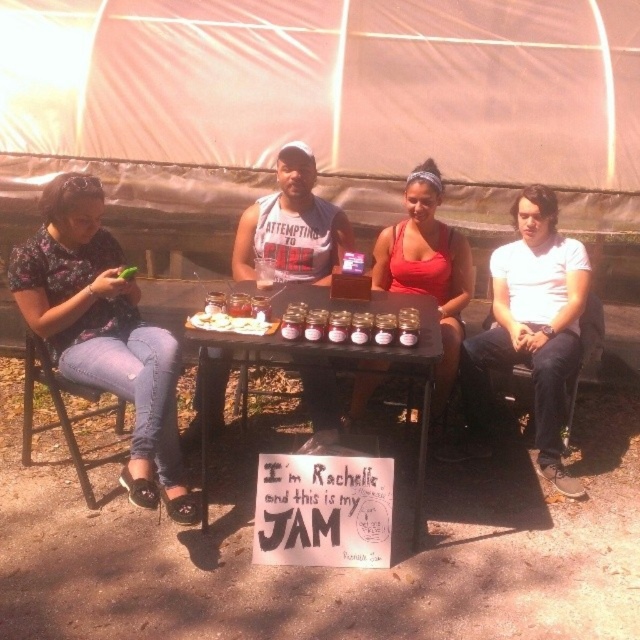
Can you confirm if floral fabric shirt at left is thinner than matte pink dress at center?

In fact, floral fabric shirt at left might be wider than matte pink dress at center.

Does floral fabric shirt at left appear on the left side of matte pink dress at center?

Correct, you'll find floral fabric shirt at left to the left of matte pink dress at center.

Image resolution: width=640 pixels, height=640 pixels. I want to click on floral fabric shirt at left, so click(x=104, y=332).

Where is `floral fabric shirt at left`? This screenshot has width=640, height=640. floral fabric shirt at left is located at coordinates (104, 332).

Who is lower down, wooden table at center or white creamy cheese at table center?

wooden table at center

Which is more to the right, wooden table at center or white creamy cheese at table center?

From the viewer's perspective, wooden table at center appears more on the right side.

Where is `wooden table at center`? This screenshot has height=640, width=640. wooden table at center is located at coordinates (332, 368).

Where is `wooden table at center`? wooden table at center is located at coordinates (332, 368).

Is matte pink dress at center wider than white creamy spread at center?

Yes, matte pink dress at center is wider than white creamy spread at center.

Can you confirm if matte pink dress at center is positioned to the right of white creamy spread at center?

Correct, you'll find matte pink dress at center to the right of white creamy spread at center.

The image size is (640, 640). Identify the location of matte pink dress at center. (428, 268).